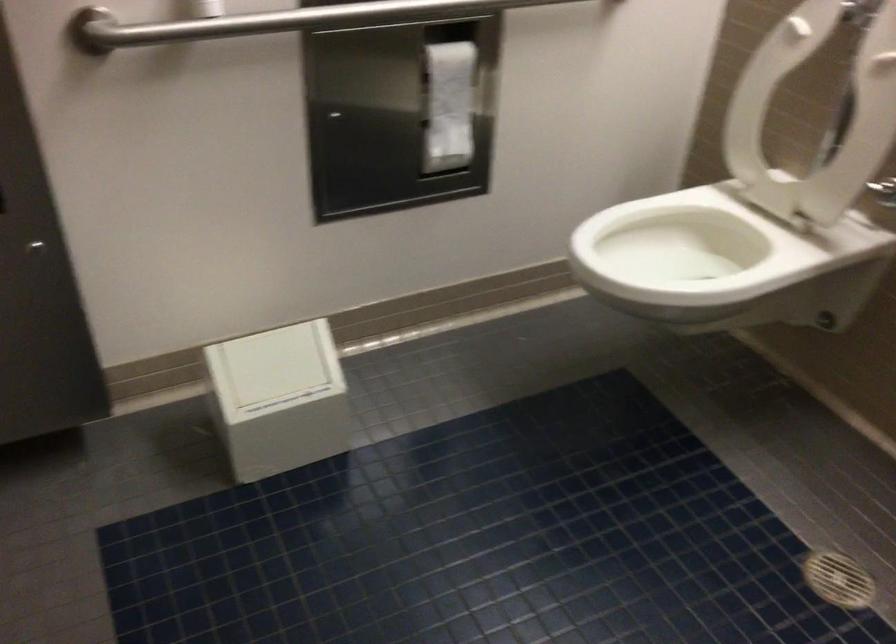
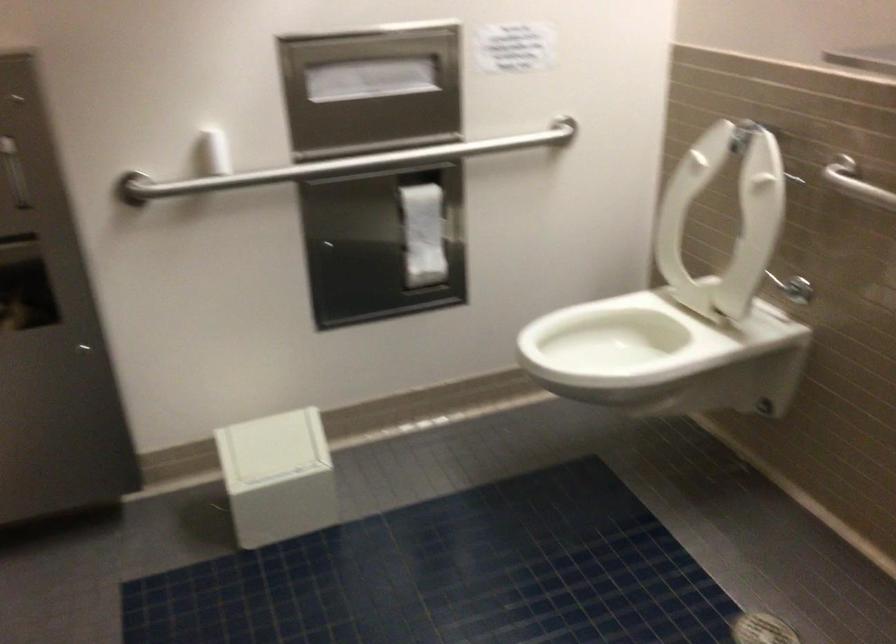
In a continuous first-person perspective shot, in which direction is the camera moving?

The movement direction of the cameraman is right, backward.